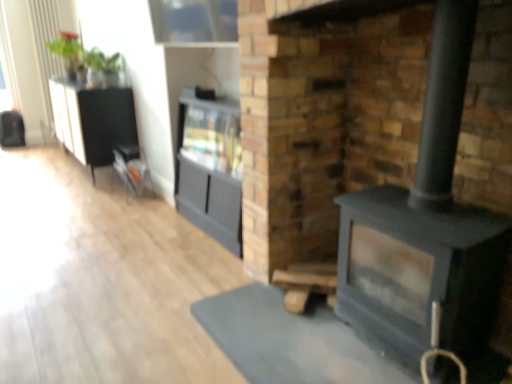
Question: Should I look upward or downward to see black textured cabinet at left, which ranks as the 1th entertainment center in back-to-front order?

Choices:
 (A) up
 (B) down

Answer: (A)

Question: Does black textured cabinet at left, positioned as the 2th entertainment center in front-to-back order, have a greater height compared to metallic silver magazine rack at left?

Choices:
 (A) no
 (B) yes

Answer: (B)

Question: Is black textured cabinet at left, acting as the second entertainment center starting from the right, to the left of metallic silver magazine rack at left from the viewer's perspective?

Choices:
 (A) no
 (B) yes

Answer: (B)

Question: Does black textured cabinet at left, which ranks as the 1th entertainment center in back-to-front order, have a lesser height compared to metallic silver magazine rack at left?

Choices:
 (A) no
 (B) yes

Answer: (A)

Question: From the image's perspective, is black textured cabinet at left, which ranks as the 1th entertainment center in back-to-front order, below metallic silver magazine rack at left?

Choices:
 (A) yes
 (B) no

Answer: (B)

Question: Are black textured cabinet at left, positioned as the 2th entertainment center in front-to-back order, and metallic silver magazine rack at left making contact?

Choices:
 (A) yes
 (B) no

Answer: (B)

Question: Is black textured cabinet at left, acting as the second entertainment center starting from the right, aimed at metallic silver magazine rack at left?

Choices:
 (A) yes
 (B) no

Answer: (B)

Question: Considering the relative positions of metallic silver magazine rack at left and matte black fireplace at center in the image provided, is metallic silver magazine rack at left to the left of matte black fireplace at center from the viewer's perspective?

Choices:
 (A) yes
 (B) no

Answer: (A)

Question: Is metallic silver magazine rack at left oriented away from matte black fireplace at center?

Choices:
 (A) no
 (B) yes

Answer: (A)

Question: Could matte black fireplace at center be considered to be inside metallic silver magazine rack at left?

Choices:
 (A) no
 (B) yes

Answer: (A)

Question: Considering the relative sizes of metallic silver magazine rack at left and matte black fireplace at center in the image provided, is metallic silver magazine rack at left shorter than matte black fireplace at center?

Choices:
 (A) no
 (B) yes

Answer: (B)

Question: From a real-world perspective, is metallic silver magazine rack at left located higher than matte black fireplace at center?

Choices:
 (A) yes
 (B) no

Answer: (B)

Question: From the image's perspective, is metallic silver magazine rack at left located above matte black fireplace at center?

Choices:
 (A) no
 (B) yes

Answer: (B)

Question: From the image's perspective, does matte gray cabinet at center, the 2th entertainment center in the back-to-front sequence, appear lower than matte black fireplace at center?

Choices:
 (A) yes
 (B) no

Answer: (B)